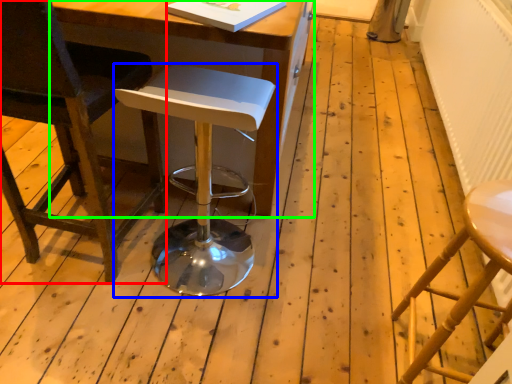
Question: Which object is positioned farthest from chair (highlighted by a red box)? Select from stool (highlighted by a blue box) and table (highlighted by a green box).

Choices:
 (A) stool
 (B) table

Answer: (A)